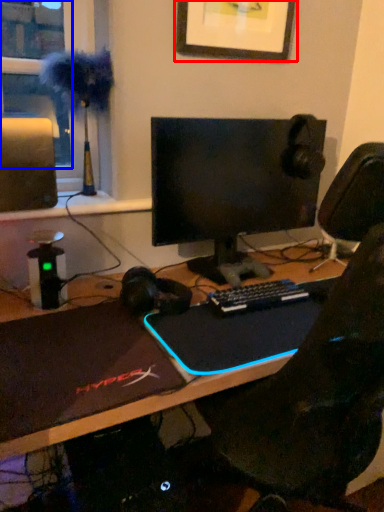
Question: Among these objects, which one is nearest to the camera, picture frame (highlighted by a red box) or window screen (highlighted by a blue box)?

Choices:
 (A) picture frame
 (B) window screen

Answer: (B)